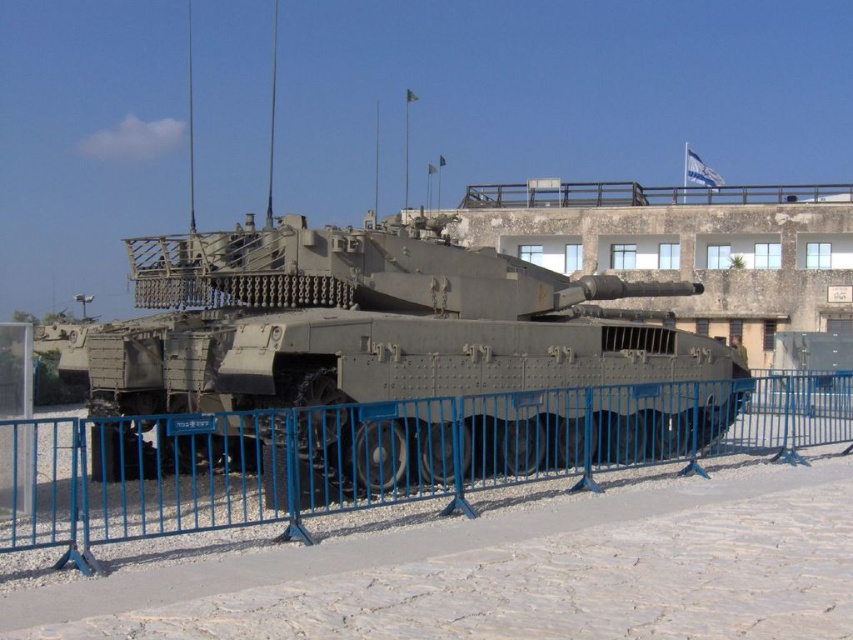
Does camouflage paint tank at center have a greater height compared to blue metal fence at lower center?

Yes, camouflage paint tank at center is taller than blue metal fence at lower center.

Who is more distant from viewer, (456, 262) or (792, 387)?

Positioned behind is point (792, 387).

Find the location of a particular element. camouflage paint tank at center is located at coordinates (370, 333).